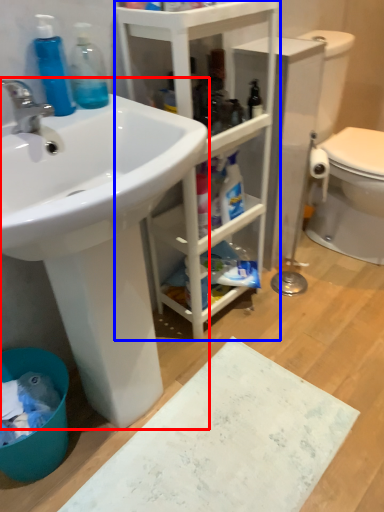
Question: Among these objects, which one is farthest to the camera, sink (highlighted by a red box) or bathroom cabinet (highlighted by a blue box)?

Choices:
 (A) sink
 (B) bathroom cabinet

Answer: (B)